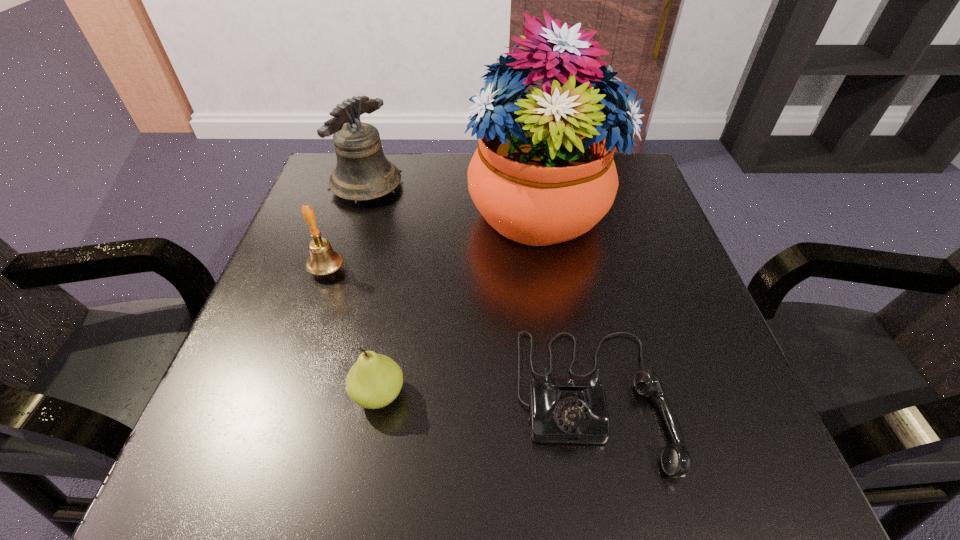
The width and height of the screenshot is (960, 540). Find the location of `vacant point located 0.090m on the right of the pear`. vacant point located 0.090m on the right of the pear is located at coordinates (463, 395).

Identify the location of flower arrangement located at the far edge. pos(543,173).

The image size is (960, 540). What are the coordinates of `bell that is at the far edge` in the screenshot? It's located at (362, 173).

The width and height of the screenshot is (960, 540). In order to click on object that is at the near edge in this screenshot , I will do [562, 410].

Identify the location of flower arrangement situated at the right edge. Image resolution: width=960 pixels, height=540 pixels. [x=543, y=173].

The width and height of the screenshot is (960, 540). In order to click on telephone located in the right edge section of the desktop in this screenshot , I will do `click(562, 410)`.

Find the location of a particular element. object that is at the far left corner is located at coordinates (362, 173).

Locate an element on the screen. Image resolution: width=960 pixels, height=540 pixels. object located at the far right corner is located at coordinates click(543, 173).

Find the location of a particular element. This screenshot has height=540, width=960. object that is positioned at the near right corner is located at coordinates (562, 410).

Image resolution: width=960 pixels, height=540 pixels. In the image, there is a desktop. Find the location of `vacant region at the far edge`. vacant region at the far edge is located at coordinates (420, 192).